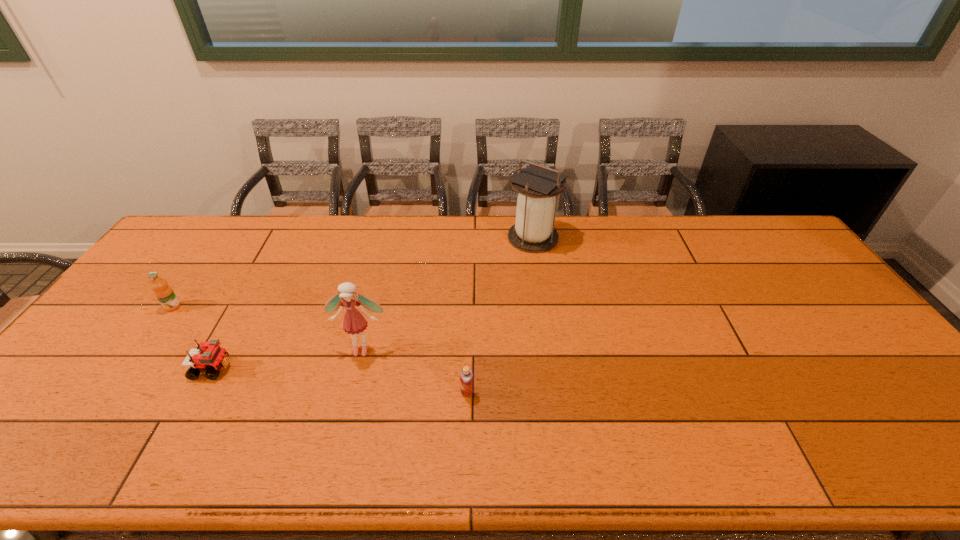
Image resolution: width=960 pixels, height=540 pixels. I want to click on free space located 0.290m on the front-facing side of the fourth shortest object, so click(x=331, y=468).

Locate an element on the screen. vacant space located 0.370m on the label of the farther orange juice is located at coordinates (84, 430).

What are the coordinates of `free space located on the left of the shorter orange juice` in the screenshot? It's located at (342, 393).

Where is `free space located on the front-facing side of the Lego`? The image size is (960, 540). free space located on the front-facing side of the Lego is located at coordinates (359, 368).

I want to click on object located in the far edge section of the desktop, so click(x=533, y=232).

Locate an element on the screen. object positioned at the left edge is located at coordinates (164, 293).

Where is `free region at the far edge of the desktop`? free region at the far edge of the desktop is located at coordinates (218, 248).

This screenshot has height=540, width=960. I want to click on vacant space at the near edge of the desktop, so click(x=228, y=439).

You are a GUI agent. You are given a task and a screenshot of the screen. Output one action in this format:
    pyautogui.click(x=<x>, y=<y>)
    Task: Click on the free space at the left edge of the desktop
    
    Given the screenshot: What is the action you would take?
    pyautogui.click(x=123, y=344)

In the image, there is a desktop. Where is `vacant space at the right edge`? This screenshot has width=960, height=540. vacant space at the right edge is located at coordinates (846, 318).